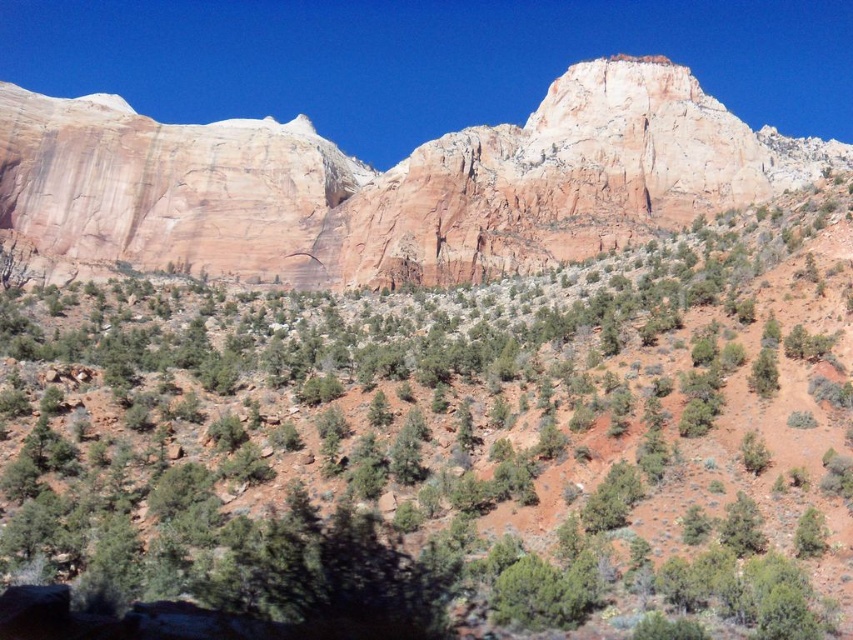
You are a hiker standing at the base of the rustic sandstone mountain at upper center. You notice a green shrub at center. In which direction relative to the mountain is the shrub located?

The green shrub at center is located to the left of the rustic sandstone mountain at upper center.

You are a hiker standing at the base of the rugged, reddish brown rock formations. You see two points marked on the slope. One is at point (827,621) and the other is at point (340,246). Which point is closer to you?

Point (827,621) is closer to the viewer than point (340,246).